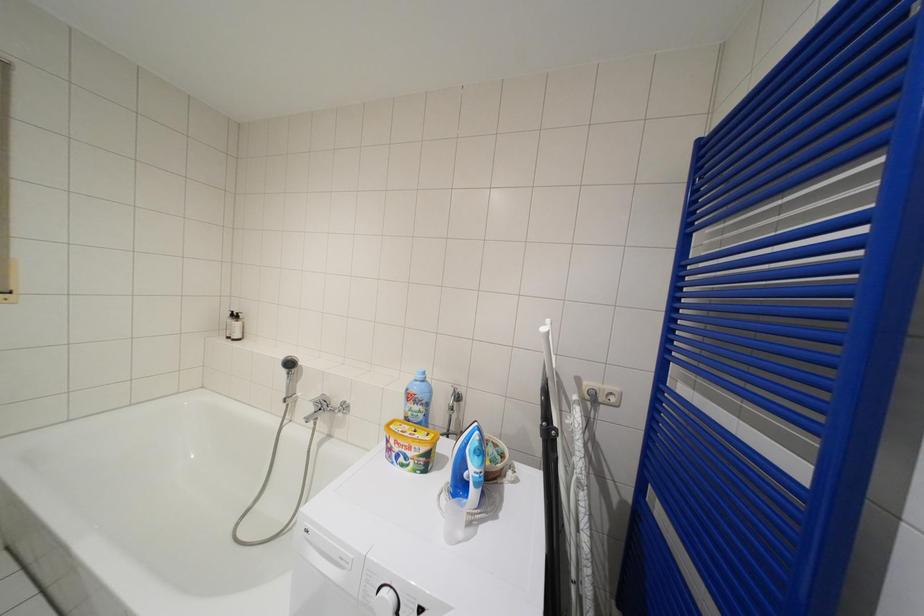
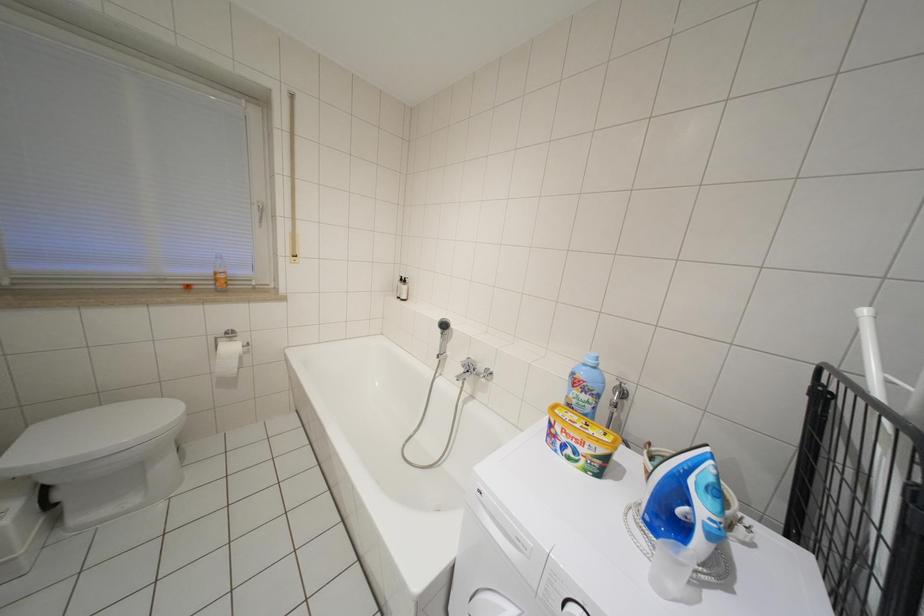
Question: Based on the continuous images, in which direction is the camera rotating? Reply with the corresponding letter.

Choices:
 (A) Left
 (B) Right
 (C) Up
 (D) Down

Answer: (A)